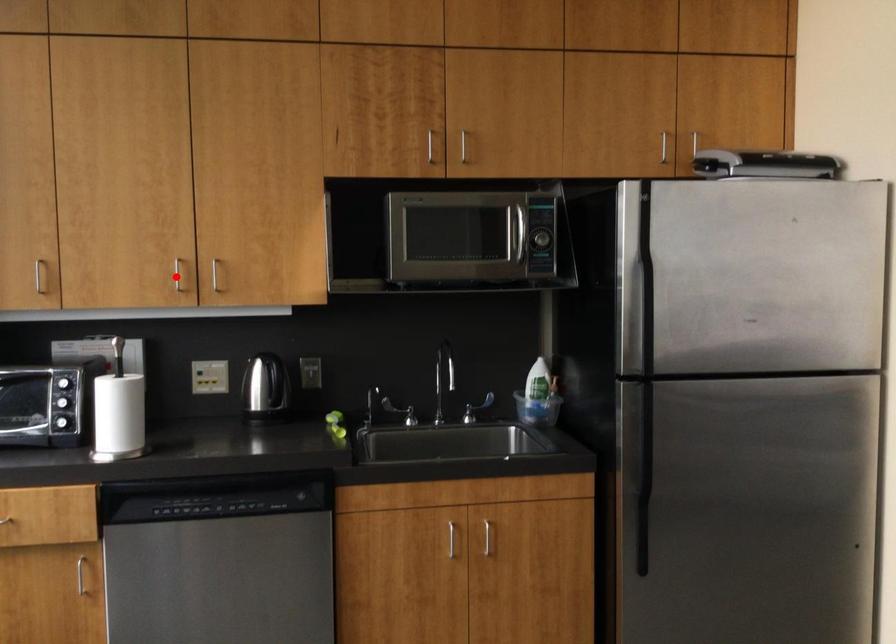
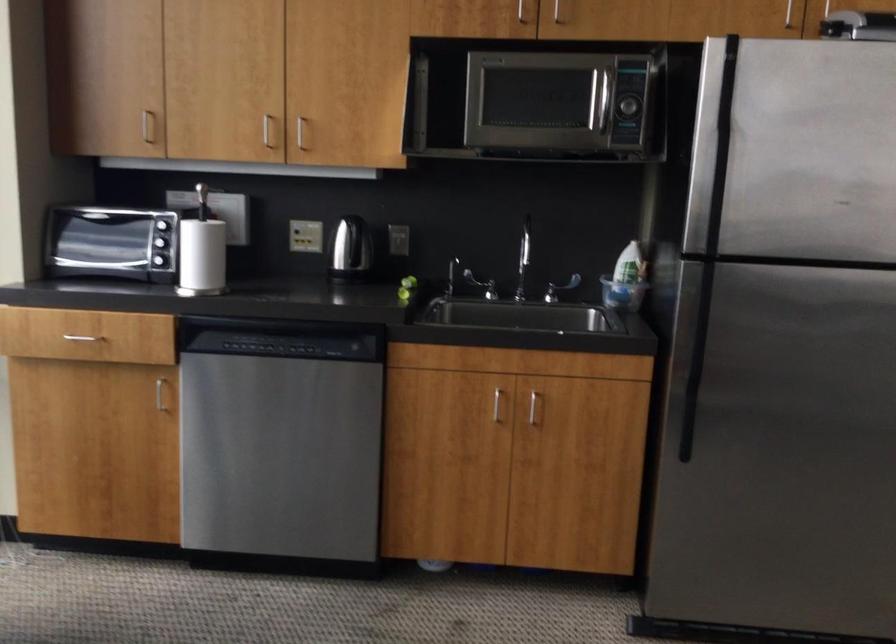
Question: I am providing you with two images of the same scene from different viewpoints. A red point is marked on the first image. Is the red point's position out of view in image 2?

Choices:
 (A) Yes
 (B) No

Answer: (B)